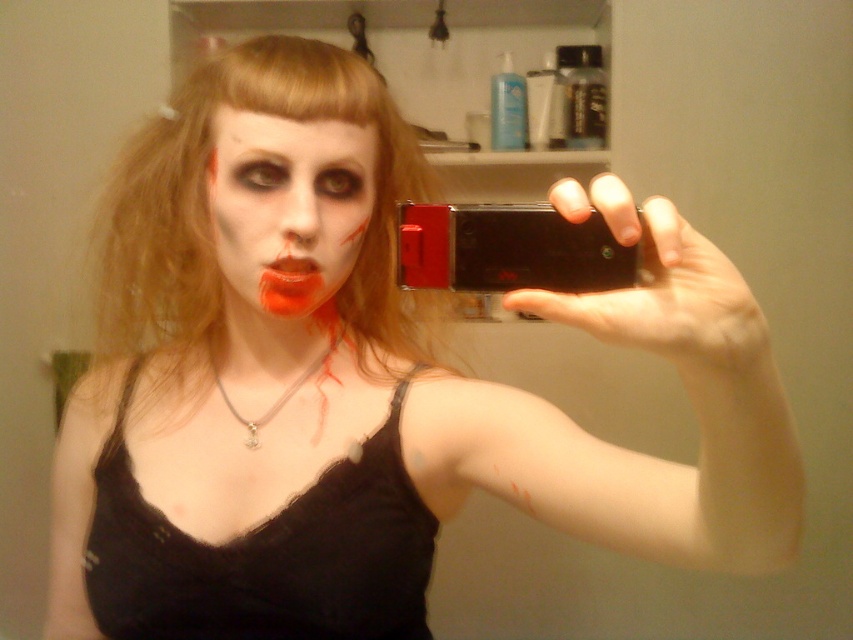
Question: Does blondehair at center have a larger size compared to matte black face at center?

Choices:
 (A) no
 (B) yes

Answer: (B)

Question: Considering the real-world distances, which object is closest to the matte black face at center?

Choices:
 (A) matte orange lips at center
 (B) silver metallic necklace at center

Answer: (A)

Question: Which of these objects is positioned farthest from the blondehair at center?

Choices:
 (A) black lace dress at center
 (B) red matte phone at center
 (C) matte orange lips at center
 (D) matte black face at center

Answer: (B)

Question: Does blondehair at center have a lesser width compared to matte black face at center?

Choices:
 (A) yes
 (B) no

Answer: (B)

Question: Estimate the real-world distances between objects in this image. Which object is farther from the matte black face at center?

Choices:
 (A) red matte phone at center
 (B) black lace dress at center
 (C) blondehair at center
 (D) matte orange lips at center

Answer: (B)

Question: Can you confirm if blondehair at center is smaller than silver metallic necklace at center?

Choices:
 (A) yes
 (B) no

Answer: (B)